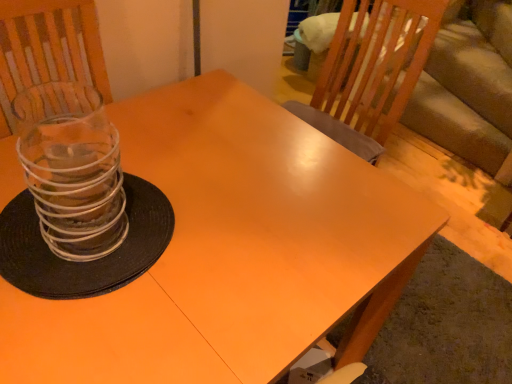
Question: Relative to clear glass candle holder at left, is matte orange table at center in front or behind?

Choices:
 (A) front
 (B) behind

Answer: (A)

Question: In terms of size, does matte orange table at center appear bigger or smaller than clear glass candle holder at left?

Choices:
 (A) small
 (B) big

Answer: (B)

Question: From the image's perspective, relative to clear glass candle holder at left, is matte orange table at center above or below?

Choices:
 (A) above
 (B) below

Answer: (B)

Question: From the image's perspective, is clear glass candle holder at left positioned above or below matte orange table at center?

Choices:
 (A) above
 (B) below

Answer: (A)

Question: Does point (111, 168) appear closer or farther from the camera than point (297, 132)?

Choices:
 (A) closer
 (B) farther

Answer: (A)

Question: In terms of size, does clear glass candle holder at left appear bigger or smaller than matte orange table at center?

Choices:
 (A) big
 (B) small

Answer: (B)

Question: Would you say clear glass candle holder at left is inside or outside matte orange table at center?

Choices:
 (A) inside
 (B) outside

Answer: (B)